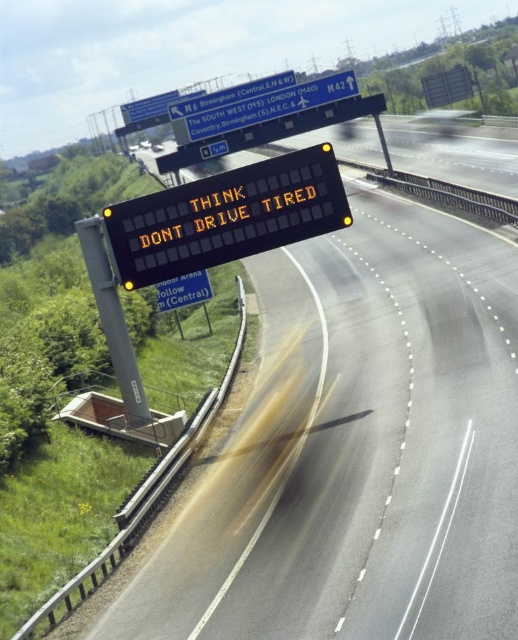
Question: Is black electronic display at upper center smaller than yellow reflective electronic display at upper center?

Choices:
 (A) no
 (B) yes

Answer: (B)

Question: Which point is closer to the camera?

Choices:
 (A) green reflective sign at central
 (B) black electronic display at upper center
 (C) yellow reflective plastic sign at upper center
 (D) black electronic sign at center

Answer: (D)

Question: Is yellow reflective plastic sign at upper center wider than yellow reflective electronic display at upper center?

Choices:
 (A) yes
 (B) no

Answer: (B)

Question: Which object appears farthest from the camera in this image?

Choices:
 (A) black electronic display at upper center
 (B) black electronic sign at center
 (C) yellow reflective plastic sign at upper center
 (D) yellow reflective electronic display at upper center

Answer: (D)

Question: Does yellow reflective plastic sign at upper center lie in front of yellow reflective electronic display at upper center?

Choices:
 (A) no
 (B) yes

Answer: (B)

Question: Which point is closer to the camera taking this photo?

Choices:
 (A) (184, 280)
 (B) (354, 84)

Answer: (A)